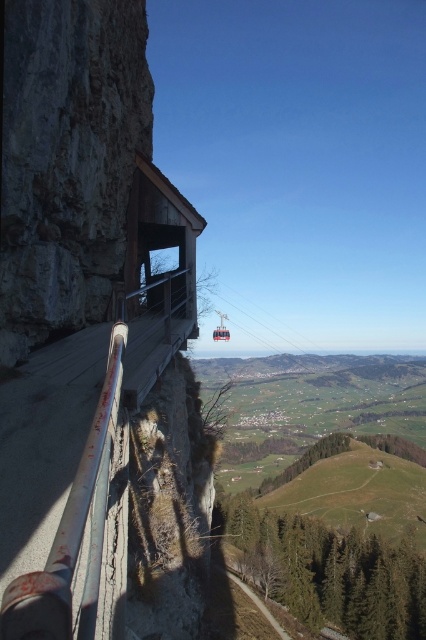
You are standing on the cliff and see the silver metallic rail at left and the metallic cable car at center. Which object is closer to the edge of the cliff?

The silver metallic rail at left is closer to the edge of the cliff because it is positioned to the right of the metallic cable car at center, which is further away from the edge.

You are standing on the cliff and see the silver metallic rail at left and the metallic cable car at center. Which object is positioned higher from the ground?

The silver metallic rail at left is located above the metallic cable car at center, so it is higher from the ground.